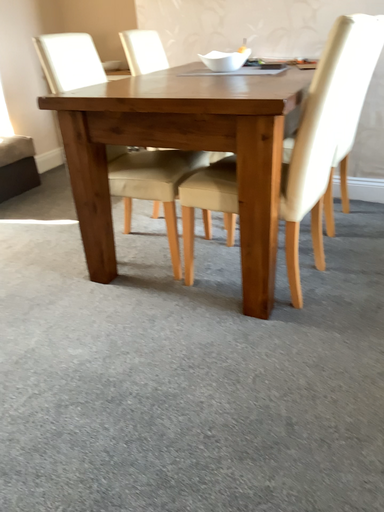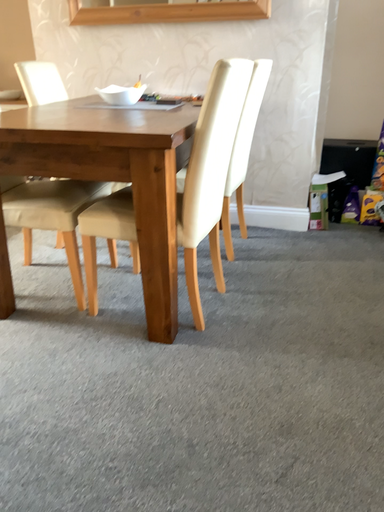
Question: Which way did the camera rotate in the video?

Choices:
 (A) rotated left
 (B) rotated right

Answer: (B)